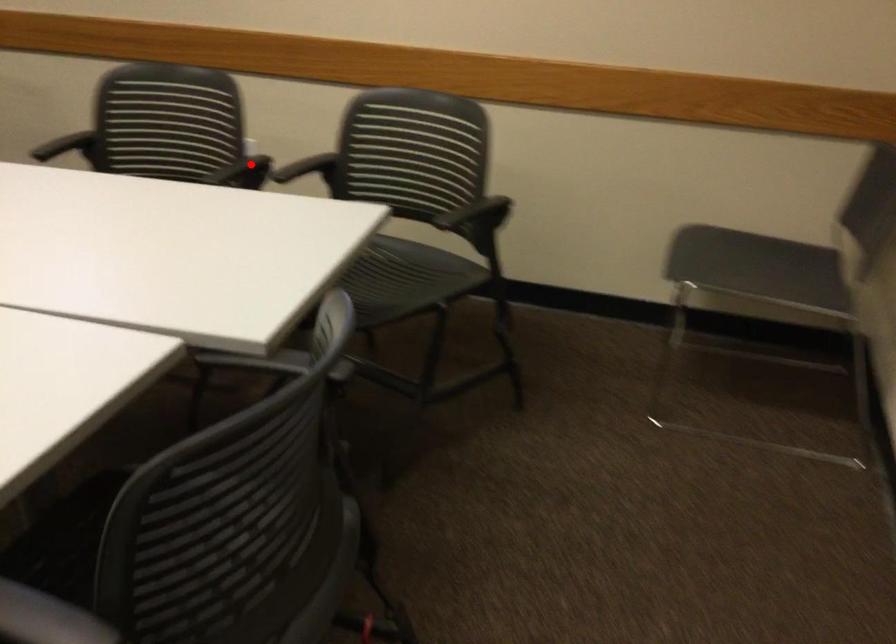
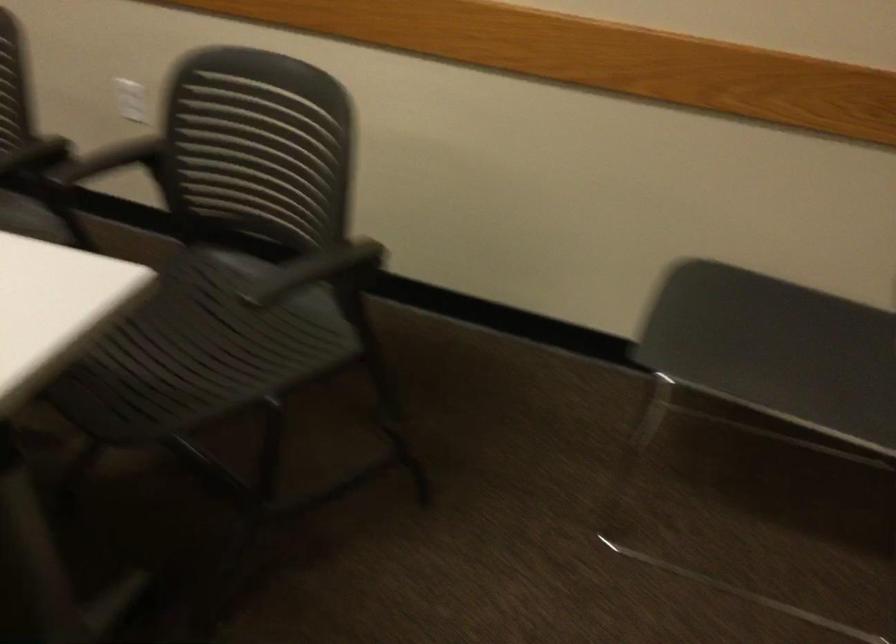
Locate, in the second image, the point that corresponds to the highlighted location in the first image.

(35, 156)